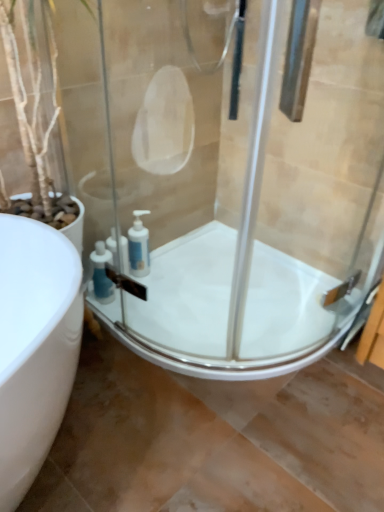
At what (x,y) coordinates should I click in order to perform the action: click on vacant space in front of white glossy soap dispenser at corner, which is counted as the first soap dispenser, starting from the right. Please return your answer as a coordinate pair (x, y). Looking at the image, I should click on (144, 305).